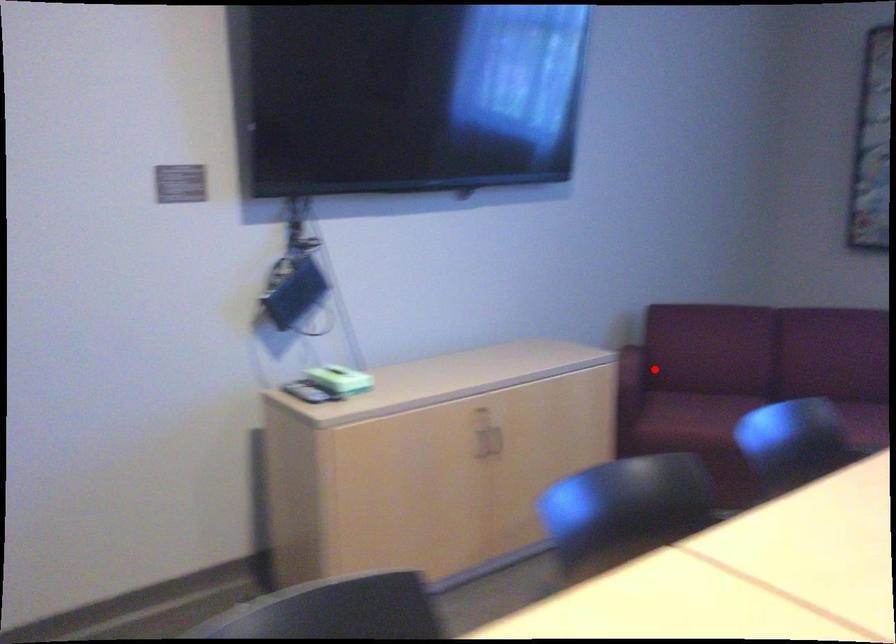
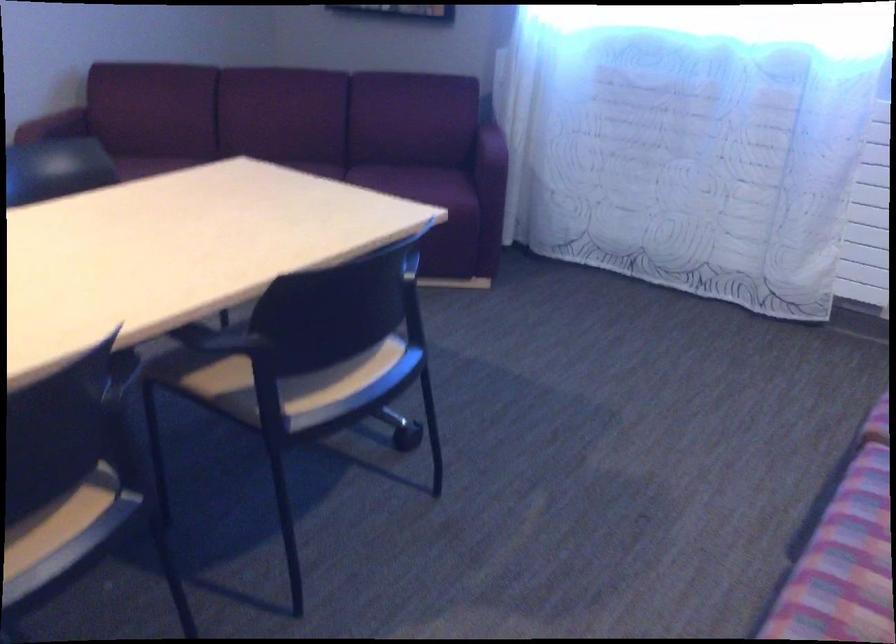
Find the pixel in the second image that matches the highlighted location in the first image.

(54, 125)